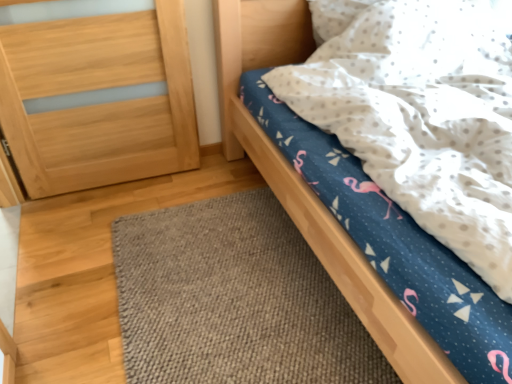
In order to click on brown woven mat at lower center in this screenshot , I will do `click(234, 300)`.

Identify the location of light brown wood at left. (101, 104).

This screenshot has width=512, height=384. What do you see at coordinates (311, 180) in the screenshot?
I see `blue fabric bed at upper right` at bounding box center [311, 180].

You are a GUI agent. You are given a task and a screenshot of the screen. Output one action in this format:
    pyautogui.click(x=<x>, y=<y>)
    Task: Click on the brown woven mat at lower center
    The width and height of the screenshot is (512, 384).
    Given the screenshot: What is the action you would take?
    pyautogui.click(x=234, y=300)

Would you say light brown wood at left is outside brown woven mat at lower center?

light brown wood at left lies outside brown woven mat at lower center's area.

Based on their sizes in the image, would you say light brown wood at left is bigger or smaller than brown woven mat at lower center?

In the image, light brown wood at left appears to be larger than brown woven mat at lower center.

In the image, is light brown wood at left positioned in front of or behind brown woven mat at lower center?

light brown wood at left is positioned farther from the viewer than brown woven mat at lower center.

This screenshot has height=384, width=512. Identify the location of balustrade to the left of brown woven mat at lower center. (101, 104).

Can you confirm if blue fabric bed at upper right is smaller than brown woven mat at lower center?

Incorrect, blue fabric bed at upper right is not smaller in size than brown woven mat at lower center.

The image size is (512, 384). In order to click on bed located above the brown woven mat at lower center (from the image's perspective) in this screenshot , I will do `click(311, 180)`.

Is brown woven mat at lower center at the back of blue fabric bed at upper right?

No, brown woven mat at lower center is not at the back of blue fabric bed at upper right.

Is blue fabric bed at upper right to the left of brown woven mat at lower center from the viewer's perspective?

Incorrect, blue fabric bed at upper right is not on the left side of brown woven mat at lower center.

Considering the relative positions of blue fabric bed at upper right and light brown wood at left in the image provided, is blue fabric bed at upper right to the right of light brown wood at left from the viewer's perspective?

Indeed, blue fabric bed at upper right is positioned on the right side of light brown wood at left.

Could you tell me if blue fabric bed at upper right is facing light brown wood at left?

No, blue fabric bed at upper right is not turned towards light brown wood at left.

Do you think blue fabric bed at upper right is within light brown wood at left, or outside of it?

blue fabric bed at upper right exists outside the volume of light brown wood at left.

How many degrees apart are the facing directions of brown woven mat at lower center and blue fabric bed at upper right?

The angular difference between brown woven mat at lower center and blue fabric bed at upper right is 86.6 degrees.

Is blue fabric bed at upper right at the back of brown woven mat at lower center?

No.

How much distance is there between brown woven mat at lower center and blue fabric bed at upper right?

brown woven mat at lower center and blue fabric bed at upper right are 16.36 inches apart.

Based on the photo, does brown woven mat at lower center appear on the right side of blue fabric bed at upper right?

Incorrect, brown woven mat at lower center is not on the right side of blue fabric bed at upper right.

From a real-world perspective, is light brown wood at left beneath blue fabric bed at upper right?

Actually, light brown wood at left is physically above blue fabric bed at upper right in the real world.

How different are the orientations of light brown wood at left and blue fabric bed at upper right in degrees?

5.44 degrees separate the facing orientations of light brown wood at left and blue fabric bed at upper right.

Is the depth of light brown wood at left greater than that of blue fabric bed at upper right?

Yes, it is.

Does point (85, 113) lie behind point (222, 73)?

No, (85, 113) is closer to viewer.

Is brown woven mat at lower center not near light brown wood at left?

No, brown woven mat at lower center is not far from light brown wood at left.

Which is correct: brown woven mat at lower center is inside light brown wood at left, or outside of it?

brown woven mat at lower center is located beyond the bounds of light brown wood at left.

From a real-world perspective, which object stands above the other?

light brown wood at left.

From their relative heights in the image, would you say brown woven mat at lower center is taller or shorter than light brown wood at left?

brown woven mat at lower center is shorter than light brown wood at left.

Find the location of a particular element. mat in front of the light brown wood at left is located at coordinates (234, 300).

At what (x,y) coordinates should I click in order to perform the action: click on mat on the left of blue fabric bed at upper right. Please return your answer as a coordinate pair (x, y). This screenshot has height=384, width=512. Looking at the image, I should click on point(234,300).

From the image, which object appears to be farther from blue fabric bed at upper right, brown woven mat at lower center or light brown wood at left?

Among the two, light brown wood at left is located further to blue fabric bed at upper right.

From the image, which object appears to be nearer to light brown wood at left, blue fabric bed at upper right or brown woven mat at lower center?

blue fabric bed at upper right is closer to light brown wood at left.

From the image, which object appears to be nearer to light brown wood at left, brown woven mat at lower center or blue fabric bed at upper right?

blue fabric bed at upper right is positioned closer to the anchor light brown wood at left.

Estimate the real-world distances between objects in this image. Which object is further from brown woven mat at lower center, blue fabric bed at upper right or light brown wood at left?

Based on the image, light brown wood at left appears to be further to brown woven mat at lower center.

From the image, which object appears to be nearer to brown woven mat at lower center, light brown wood at left or blue fabric bed at upper right?

Among the two, blue fabric bed at upper right is located nearer to brown woven mat at lower center.

Considering their positions, is light brown wood at left positioned further to blue fabric bed at upper right than brown woven mat at lower center?

light brown wood at left lies further to blue fabric bed at upper right than the other object.

The width and height of the screenshot is (512, 384). What are the coordinates of `mat situated between light brown wood at left and blue fabric bed at upper right from left to right` in the screenshot? It's located at (234, 300).